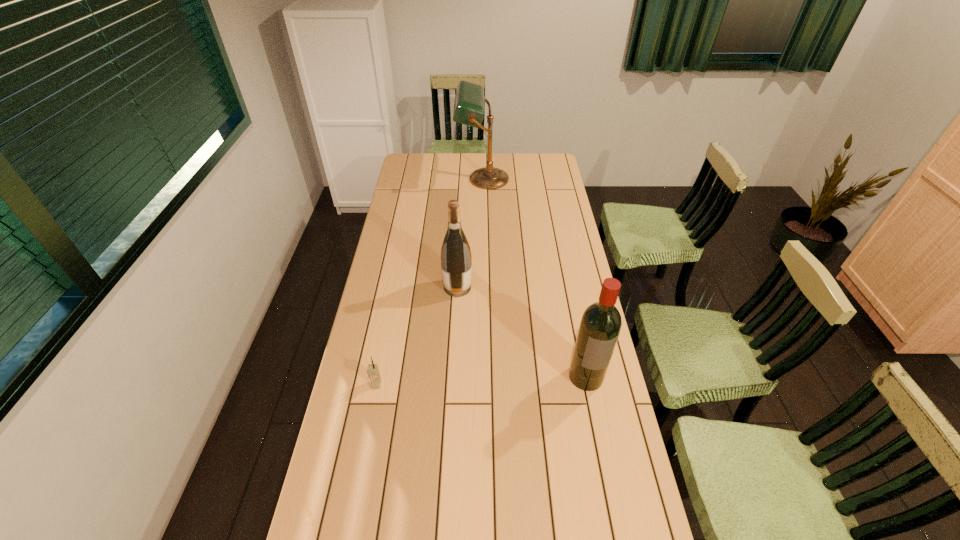
Find the location of a particular element. The image size is (960, 540). vacant area that lies between the cellular telephone and the table lamp is located at coordinates (430, 282).

The height and width of the screenshot is (540, 960). Find the location of `unoccupied area between the shortest object and the rightmost object`. unoccupied area between the shortest object and the rightmost object is located at coordinates (481, 380).

I want to click on empty location between the third nearest object and the leftmost object, so click(417, 336).

You are a GUI agent. You are given a task and a screenshot of the screen. Output one action in this format:
    pyautogui.click(x=<x>, y=<y>)
    Task: Click on the free space between the table lamp and the right wine bottle
    The image size is (960, 540).
    Given the screenshot: What is the action you would take?
    pyautogui.click(x=535, y=278)

You are a GUI agent. You are given a task and a screenshot of the screen. Output one action in this format:
    pyautogui.click(x=<x>, y=<y>)
    Task: Click on the vacant region between the leftmost object and the farthest object
    
    Given the screenshot: What is the action you would take?
    pyautogui.click(x=430, y=282)

Where is `empty space between the right wine bottle and the table lamp`? The height and width of the screenshot is (540, 960). empty space between the right wine bottle and the table lamp is located at coordinates (535, 278).

Locate an element on the screen. This screenshot has width=960, height=540. empty space that is in between the farthest object and the rightmost object is located at coordinates (535, 278).

Locate an element on the screen. Image resolution: width=960 pixels, height=540 pixels. free spot between the leftmost object and the left wine bottle is located at coordinates (417, 336).

You are a GUI agent. You are given a task and a screenshot of the screen. Output one action in this format:
    pyautogui.click(x=<x>, y=<y>)
    Task: Click on the free space between the right wine bottle and the table lamp
    The width and height of the screenshot is (960, 540).
    Given the screenshot: What is the action you would take?
    pos(535,278)

I want to click on vacant point located between the cellular telephone and the third nearest object, so click(x=417, y=336).